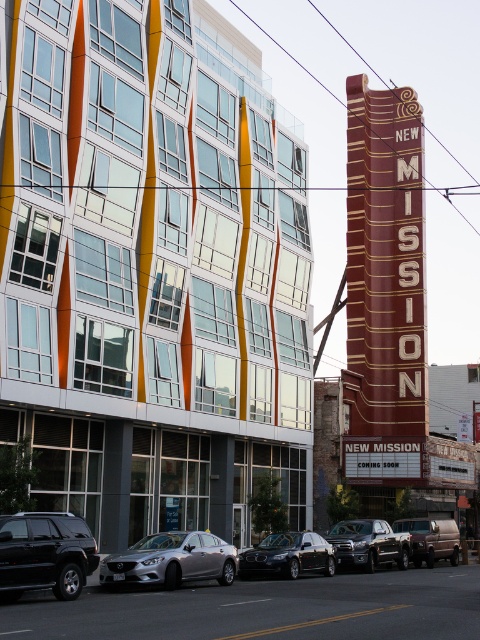
You are a pedestrian standing on the sidewalk. You see a silver metallic sedan at center and a metallic silver van at center. Which vehicle is nearer to you?

The silver metallic sedan at center is closer to the viewer than the metallic silver van at center.

You are a delivery person needing to park your vehicle in a tight space between the contemporary building with orange and yellow stripes and the vintage NEW MISSION sign. You have two options, the silver metallic sedan at center and the metallic silver van at center. Which vehicle would you choose to ensure it fits in the space?

You should choose the metallic silver van at center because it is smaller in size compared to the silver metallic sedan at center, making it more suitable for the tight parking space.

You are a delivery person who needs to park your silver metallic sedan at center in a parking spot located at coordinates 0.875, 0.358. Is the parking spot available?

The silver metallic sedan at center is already located at point (171, 560), so the parking spot is not available.